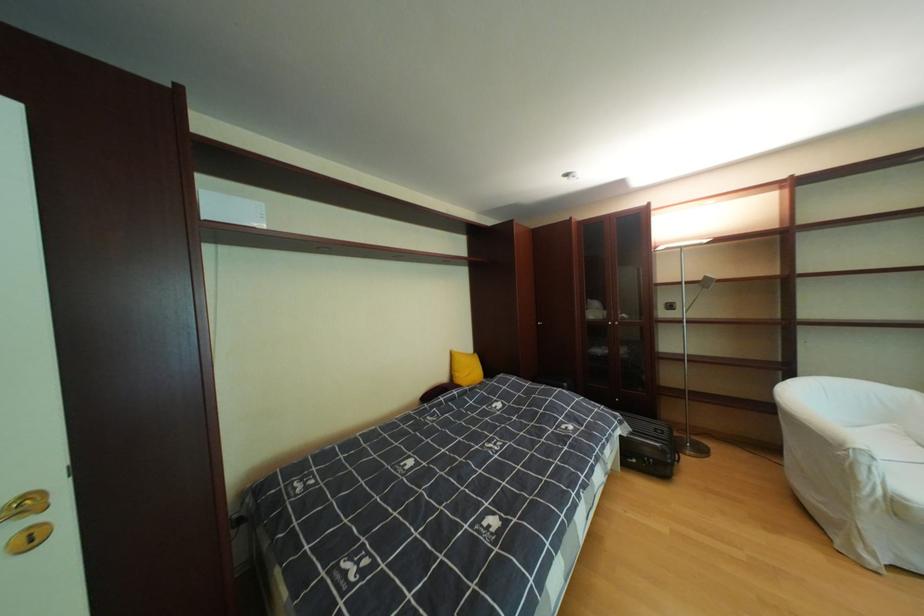
The height and width of the screenshot is (616, 924). What do you see at coordinates (28, 538) in the screenshot?
I see `a gold door handle` at bounding box center [28, 538].